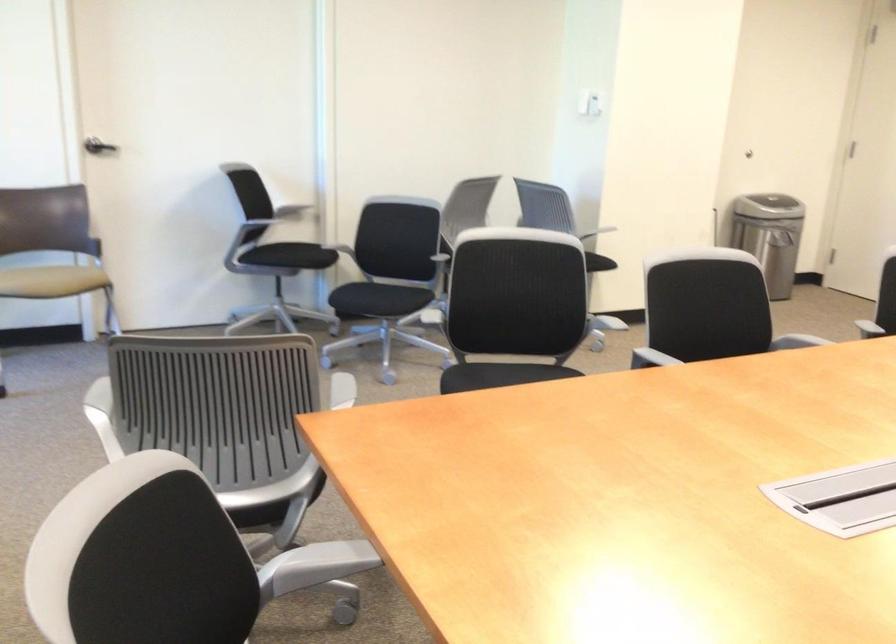
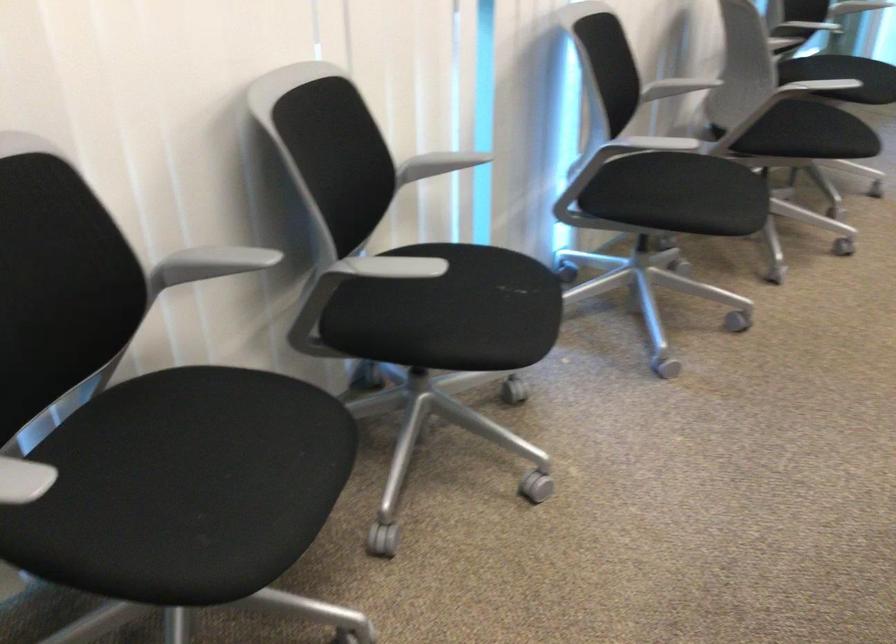
Based on the continuous images, in which direction is the camera rotating?

The camera's rotation is toward left-down.